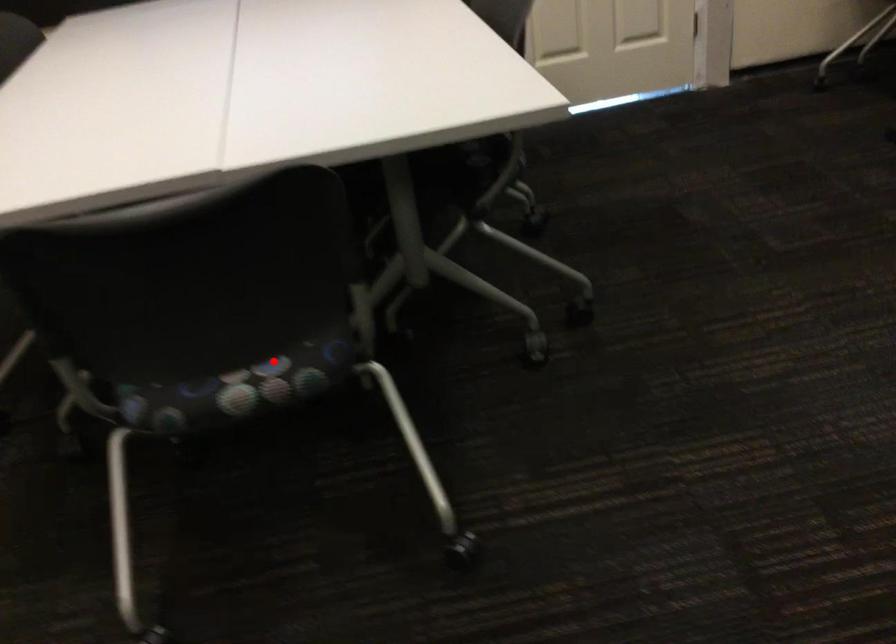
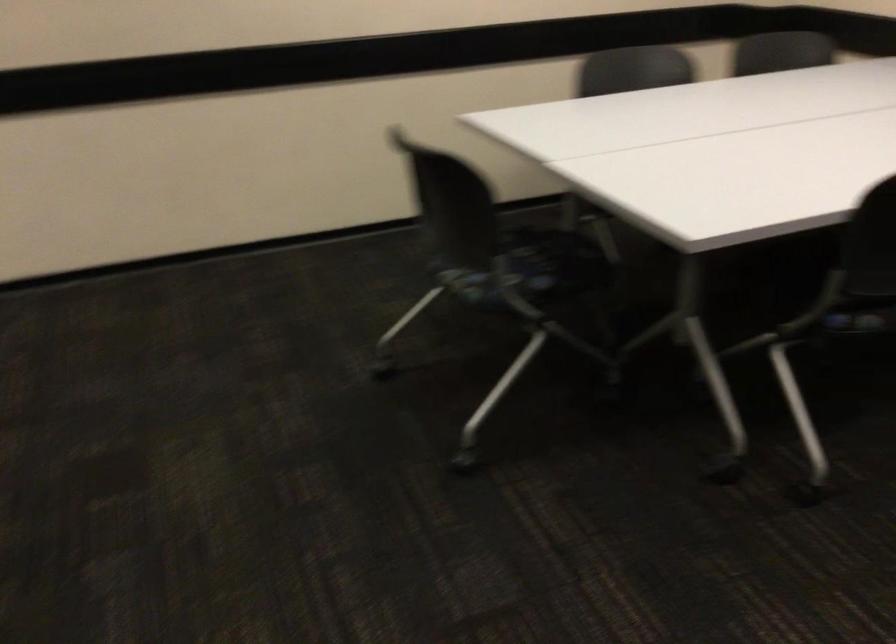
The point at the highlighted location is marked in the first image. Where is the corresponding point in the second image?

(494, 285)